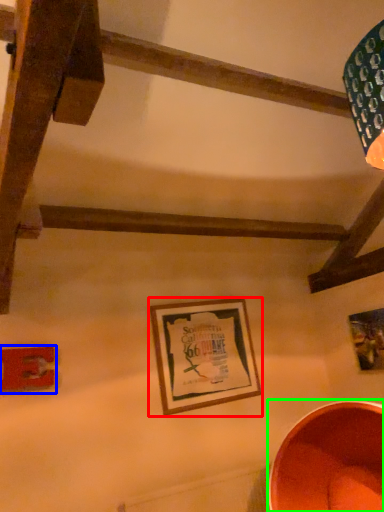
Question: Estimate the real-world distances between objects in this image. Which object is closer to picture frame (highlighted by a red box), picture frame (highlighted by a blue box) or basin (highlighted by a green box)?

Choices:
 (A) picture frame
 (B) basin

Answer: (B)